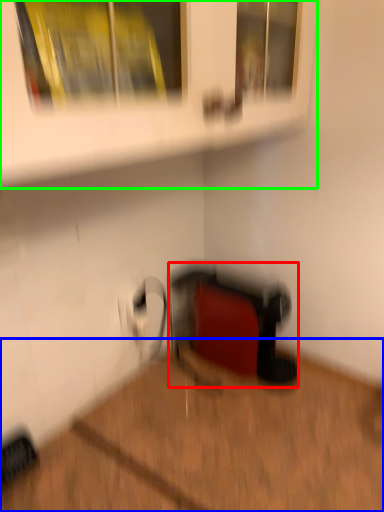
Question: Estimate the real-world distances between objects in this image. Which object is closer to wide (highlighted by a red box), hardwood (highlighted by a blue box) or shelf (highlighted by a green box)?

Choices:
 (A) hardwood
 (B) shelf

Answer: (A)